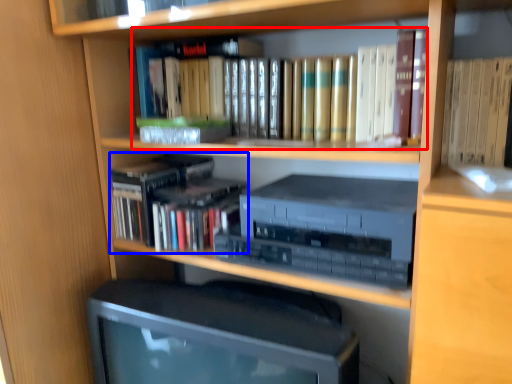
Question: Which point is further to the camera, book (highlighted by a red box) or book (highlighted by a blue box)?

Choices:
 (A) book
 (B) book

Answer: (B)